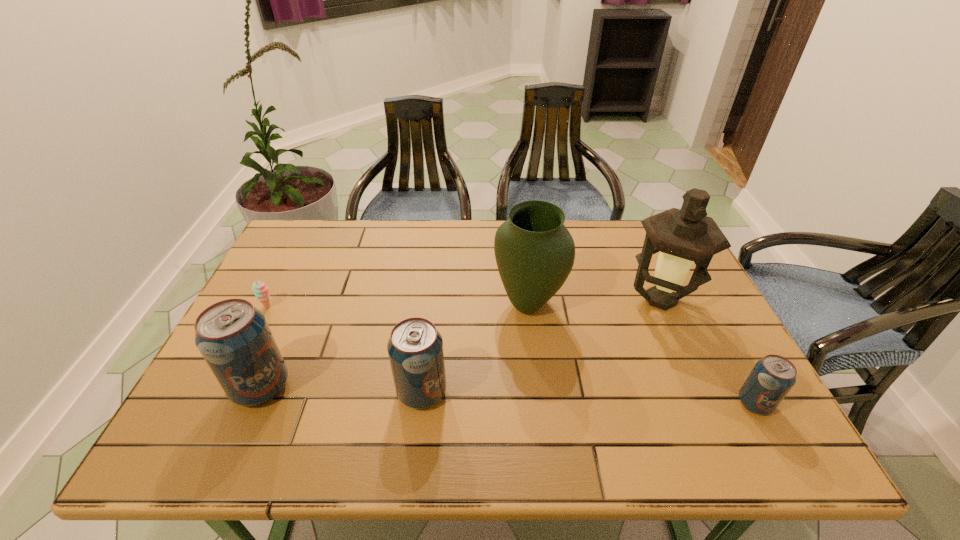
This screenshot has width=960, height=540. I want to click on vacant position in the image that satisfies the following two spatial constraints: 1. on the front side of the second pop soda from left to right; 2. on the right side of the leftmost pop soda, so click(x=258, y=392).

At what (x,y) coordinates should I click in order to perform the action: click on blank area in the image that satisfies the following two spatial constraints: 1. on the front side of the second shortest object; 2. on the right side of the fifth shortest object. Please return your answer as a coordinate pair (x, y). Looking at the image, I should click on (540, 403).

Locate an element on the screen. free space that satisfies the following two spatial constraints: 1. on the back side of the second pop soda from left to right; 2. on the right side of the oil lamp is located at coordinates (433, 300).

This screenshot has width=960, height=540. I want to click on vacant space that satisfies the following two spatial constraints: 1. on the front side of the oil lamp; 2. on the right side of the fifth tallest object, so click(x=707, y=403).

What are the coordinates of `vacant area that satisfies the following two spatial constraints: 1. on the front side of the shortest object; 2. on the right side of the leftmost pop soda` in the screenshot? It's located at (x=227, y=387).

Identify the location of vacant area in the image that satisfies the following two spatial constraints: 1. on the front side of the shortest pop soda; 2. on the right side of the third object from right to left. (540, 403).